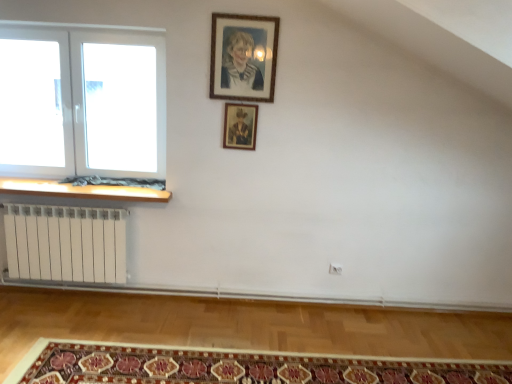
In order to face wooden picture frame at upper center, the 1th picture frame positioned from the back, should I rotate leftwards or rightwards?

You should look left and rotate roughly 2.071 degrees.

Describe the element at coordinates (236, 367) in the screenshot. I see `carpeted mat at lower center` at that location.

The width and height of the screenshot is (512, 384). Describe the element at coordinates (81, 190) in the screenshot. I see `wooden at left` at that location.

Image resolution: width=512 pixels, height=384 pixels. I want to click on white plastic window at left, so click(x=82, y=102).

Is wooden at left turned away from wooden picture frame at upper center, which appears as the second picture frame when viewed from the front?

No, wooden at left's orientation is not away from wooden picture frame at upper center, which appears as the second picture frame when viewed from the front.

Considering the relative positions of wooden at left and wooden picture frame at upper center, the 1th picture frame positioned from the back, in the image provided, is wooden at left to the right of wooden picture frame at upper center, the 1th picture frame positioned from the back, from the viewer's perspective?

In fact, wooden at left is to the left of wooden picture frame at upper center, the 1th picture frame positioned from the back.

Is wooden at left placed right next to wooden picture frame at upper center, which is the first picture frame from bottom to top?

No, wooden at left is not beside wooden picture frame at upper center, which is the first picture frame from bottom to top.

From a real-world perspective, does wooden at left sit lower than wooden picture frame at upper center, which appears as the second picture frame when viewed from the front?

Indeed, from a real-world perspective, wooden at left is positioned beneath wooden picture frame at upper center, which appears as the second picture frame when viewed from the front.

Based on the photo, how different are the orientations of wooden picture frame at upper center, which appears as the second picture frame when viewed from the front, and white plastic window at left in degrees?

They differ by 0.00127 degrees in their facing directions.

Is wooden picture frame at upper center, which is the first picture frame from bottom to top, to the left or to the right of white plastic window at left in the image?

Clearly, wooden picture frame at upper center, which is the first picture frame from bottom to top, is on the right of white plastic window at left in the image.

Is wooden picture frame at upper center, positioned as the 2th picture frame in top-to-bottom order, beside white plastic window at left?

There is a gap between wooden picture frame at upper center, positioned as the 2th picture frame in top-to-bottom order, and white plastic window at left.

Is wooden picture frame at upper center, the 1th picture frame positioned from the back, situated inside white plastic window at left or outside?

wooden picture frame at upper center, the 1th picture frame positioned from the back, is located beyond the bounds of white plastic window at left.

Consider the image. Is carpeted mat at lower center oriented towards wooden picture frame at upper center, positioned as the 2th picture frame in top-to-bottom order?

No.

Which point is more distant from viewer, (330, 359) or (241, 129)?

The point (241, 129) is farther from the camera.

Between carpeted mat at lower center and wooden picture frame at upper center, which is the first picture frame from bottom to top, which one has smaller size?

With smaller size is wooden picture frame at upper center, which is the first picture frame from bottom to top.

This screenshot has height=384, width=512. I want to click on mat in front of the wooden picture frame at upper center, which appears as the second picture frame when viewed from the front, so click(236, 367).

Does wooden picture frame at upper center, the 1th picture frame positioned from the back, contain wooden at left?

No, wooden at left is not surrounded by wooden picture frame at upper center, the 1th picture frame positioned from the back.

The image size is (512, 384). In order to click on window sill that is behind the wooden picture frame at upper center, which is the first picture frame from bottom to top in this screenshot , I will do `click(81, 190)`.

From the image's perspective, is wooden picture frame at upper center, the 1th picture frame positioned from the back, located above or below wooden at left?

Based on their image positions, wooden picture frame at upper center, the 1th picture frame positioned from the back, is located above wooden at left.

From the image's perspective, which one is positioned higher, wooden picture frame at upper center, which is the first picture frame from bottom to top, or wooden picture frame at upper center, the 2th picture frame ordered from the bottom?

wooden picture frame at upper center, the 2th picture frame ordered from the bottom, appears higher in the image.

Would you consider wooden picture frame at upper center, which is the first picture frame from bottom to top, to be distant from wooden picture frame at upper center, which is the first picture frame in top-to-bottom order?

No, wooden picture frame at upper center, which is the first picture frame from bottom to top, is not far away from wooden picture frame at upper center, which is the first picture frame in top-to-bottom order.

Image resolution: width=512 pixels, height=384 pixels. Identify the location of picture frame on the left side of wooden picture frame at upper center, the 2th picture frame when ordered from back to front. (240, 126).

Looking at this image, considering the relative sizes of wooden picture frame at upper center, which appears as the second picture frame when viewed from the front, and wooden picture frame at upper center, which is the 1th picture frame from front to back, in the image provided, is wooden picture frame at upper center, which appears as the second picture frame when viewed from the front, shorter than wooden picture frame at upper center, which is the 1th picture frame from front to back,?

Yes, wooden picture frame at upper center, which appears as the second picture frame when viewed from the front, is shorter than wooden picture frame at upper center, which is the 1th picture frame from front to back.

Which object is more forward, white plastic window at left or carpeted mat at lower center?

carpeted mat at lower center is in front.

Is point (6, 34) farther from viewer compared to point (355, 366)?

Yes, point (6, 34) is behind point (355, 366).

Considering the relative sizes of white plastic window at left and carpeted mat at lower center in the image provided, is white plastic window at left smaller than carpeted mat at lower center?

Actually, white plastic window at left might be larger than carpeted mat at lower center.

Considering the positions of objects white plastic window at left and carpeted mat at lower center in the image provided, who is more to the right, white plastic window at left or carpeted mat at lower center?

Positioned to the right is carpeted mat at lower center.

Consider the image. Is white plastic window at left facing away from wooden at left?

That's not correct — white plastic window at left is not looking away from wooden at left.

Is white plastic window at left spatially inside wooden at left, or outside of it?

white plastic window at left is not inside wooden at left, it's outside.

Considering the sizes of white plastic window at left and wooden at left in the image, is white plastic window at left wider or thinner than wooden at left?

white plastic window at left is thinner than wooden at left.

In order to click on the 1st picture frame in front of the wooden at left in this screenshot , I will do `click(240, 126)`.

This screenshot has height=384, width=512. There is a wooden picture frame at upper center, positioned as the 2th picture frame in top-to-bottom order. What are the coordinates of `window above it (from a real-world perspective)` in the screenshot? It's located at (82, 102).

Estimate the real-world distances between objects in this image. Which object is further from wooden at left, wooden picture frame at upper center, positioned as the 2th picture frame in top-to-bottom order, or wooden picture frame at upper center, the 2th picture frame ordered from the bottom?

wooden picture frame at upper center, the 2th picture frame ordered from the bottom, is further to wooden at left.

Estimate the real-world distances between objects in this image. Which object is further from wooden at left, wooden picture frame at upper center, which is the first picture frame in top-to-bottom order, or white plastic window at left?

Based on the image, wooden picture frame at upper center, which is the first picture frame in top-to-bottom order, appears to be further to wooden at left.

In the scene shown: Looking at the image, which one is located further to carpeted mat at lower center, wooden picture frame at upper center, the 2th picture frame when ordered from back to front, or wooden picture frame at upper center, which appears as the second picture frame when viewed from the front?

wooden picture frame at upper center, the 2th picture frame when ordered from back to front, is positioned further to the anchor carpeted mat at lower center.

From the image, which object appears to be nearer to carpeted mat at lower center, wooden picture frame at upper center, positioned as the 2th picture frame in top-to-bottom order, or white plastic window at left?

Among the two, wooden picture frame at upper center, positioned as the 2th picture frame in top-to-bottom order, is located nearer to carpeted mat at lower center.

When comparing their distances from wooden picture frame at upper center, the 1th picture frame positioned from the back, does white plastic window at left or carpeted mat at lower center seem further?

The object further to wooden picture frame at upper center, the 1th picture frame positioned from the back, is carpeted mat at lower center.

Considering their positions, is wooden picture frame at upper center, the 2th picture frame when ordered from back to front, positioned further to white plastic window at left than wooden at left?

Among the two, wooden picture frame at upper center, the 2th picture frame when ordered from back to front, is located further to white plastic window at left.

Considering their positions, is carpeted mat at lower center positioned further to white plastic window at left than wooden picture frame at upper center, the 1th picture frame positioned from the back?

Based on the image, carpeted mat at lower center appears to be further to white plastic window at left.

Estimate the real-world distances between objects in this image. Which object is closer to white plastic window at left, wooden at left or wooden picture frame at upper center, which is the first picture frame from bottom to top?

wooden at left is positioned closer to the anchor white plastic window at left.

Find the location of `picture frame between white plastic window at left and wooden picture frame at upper center, the 2th picture frame when ordered from back to front`. picture frame between white plastic window at left and wooden picture frame at upper center, the 2th picture frame when ordered from back to front is located at coordinates (240, 126).

Locate an element on the screen. This screenshot has height=384, width=512. window between wooden picture frame at upper center, which is the 1th picture frame from front to back, and carpeted mat at lower center, in the vertical direction is located at coordinates 82,102.

Where is `window sill between white plastic window at left and carpeted mat at lower center in the up-down direction`? The image size is (512, 384). window sill between white plastic window at left and carpeted mat at lower center in the up-down direction is located at coordinates (81, 190).

Find the location of a particular element. window sill between white plastic window at left and wooden picture frame at upper center, the 1th picture frame positioned from the back is located at coordinates (81, 190).